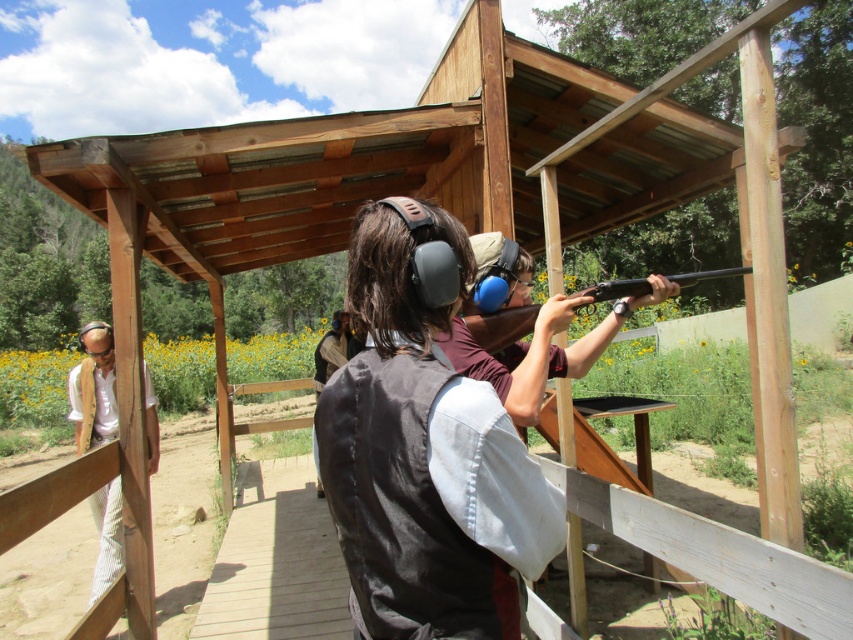
You are a photographer standing at the shooting range and want to take a picture of the dark brown leather vest at center. Your camera is 38.48 inches away from the vest. Can you fit the entire vest into your camera frame without moving either?

The dark brown leather vest at center and camera are 38.48 inches apart, so yes, the photographer can fit the entire vest into the camera frame without moving either since the distance matches the required framing.

You are a photographer at the shooting range and want to capture a photo of both the dark brown leather vest at center and the white striped pants at left. Based on their positions, which object should you focus on first to ensure both are in the frame?

The dark brown leather vest at center is positioned on the right side of white striped pants at left, so you should focus on the white striped pants at left first to ensure both are in the frame.

You are a safety inspector at the shooting range. You need to ensure that the dark brown leather vest at center and the white striped pants at left are not overlapping in the path. Can you confirm if there is enough space between them?

The dark brown leather vest at center has a lesser width compared to white striped pants at left, so there is sufficient space between them to prevent overlapping in the path.